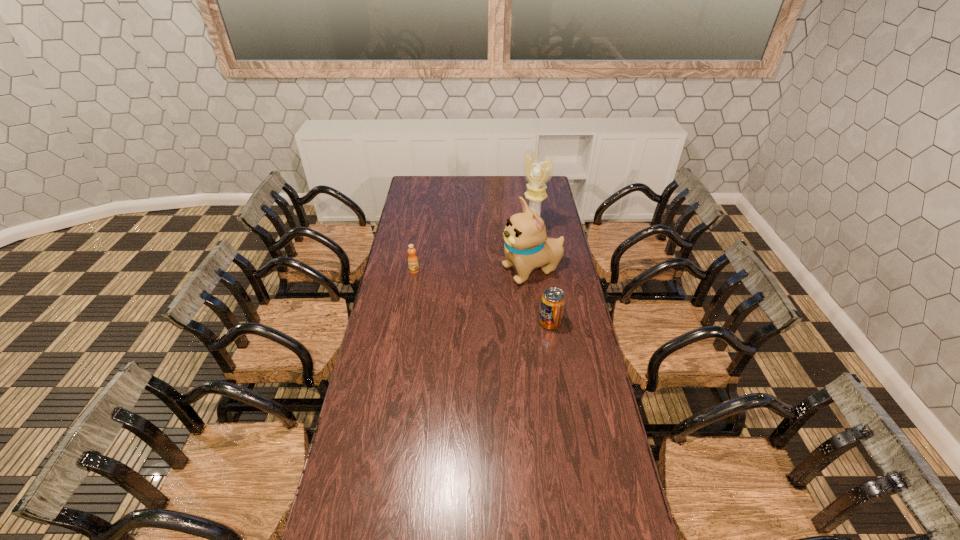
Locate an element on the screen. The width and height of the screenshot is (960, 540). free point located on the face of the puppy is located at coordinates (461, 290).

I want to click on vacant space located on the face of the puppy, so click(x=463, y=289).

This screenshot has width=960, height=540. Find the location of `object that is at the left edge`. object that is at the left edge is located at coordinates (413, 264).

The image size is (960, 540). I want to click on soda can that is at the right edge, so click(553, 300).

This screenshot has width=960, height=540. What are the coordinates of `award present at the right edge` in the screenshot? It's located at (538, 172).

This screenshot has width=960, height=540. In order to click on puppy present at the right edge in this screenshot , I will do (526, 247).

Where is `vacant space at the far edge of the desktop`? vacant space at the far edge of the desktop is located at coordinates (505, 179).

Find the location of a particular element. The image size is (960, 540). free space at the near edge of the desktop is located at coordinates (549, 535).

This screenshot has width=960, height=540. What are the coordinates of `free spot at the left edge of the desktop` in the screenshot? It's located at (404, 342).

This screenshot has height=540, width=960. In the image, there is a desktop. Identify the location of vacant space at the right edge. (585, 400).